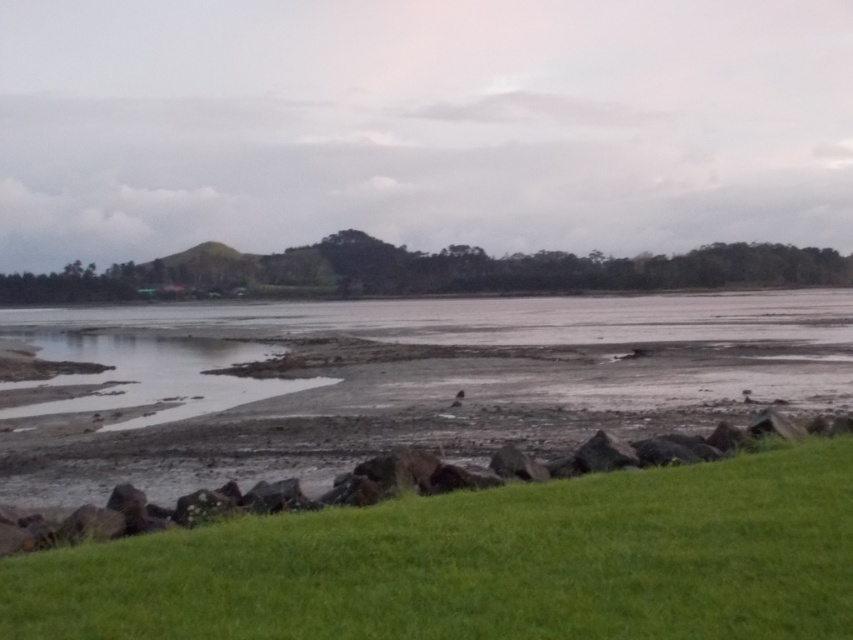
Is green grassy at lower right thinner than muddy wetland at lower left?

Yes.

Does green grassy at lower right have a smaller size compared to muddy wetland at lower left?

Indeed, green grassy at lower right has a smaller size compared to muddy wetland at lower left.

Where is `green grassy at lower right`? green grassy at lower right is located at coordinates (483, 564).

Identify the location of green grassy at lower right. coord(483,564).